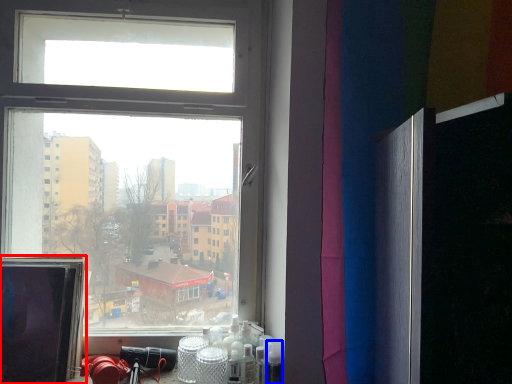
Question: Which object appears closest to the camera in this image, computer screen (highlighted by a red box) or toiletry (highlighted by a blue box)?

Choices:
 (A) computer screen
 (B) toiletry

Answer: (A)